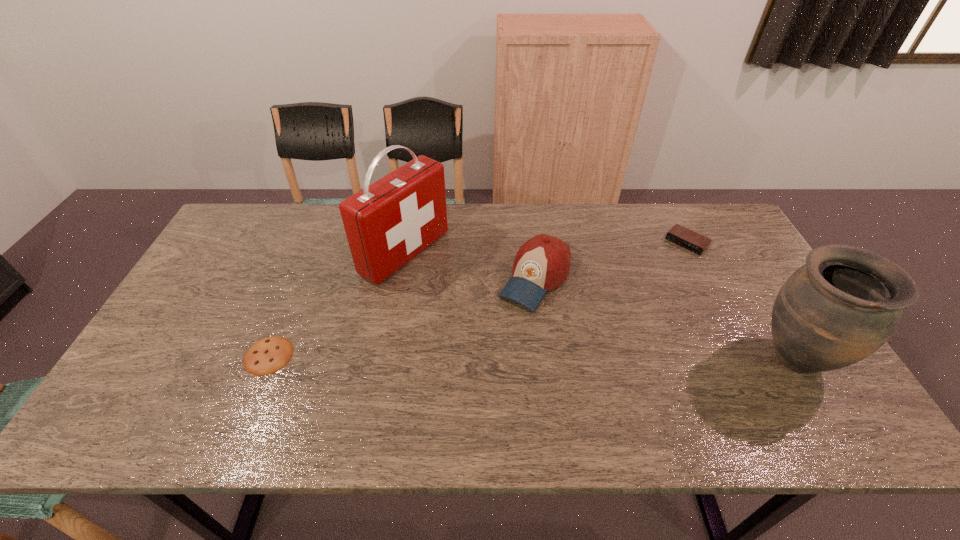
The image size is (960, 540). I want to click on the first-aid kit that is at the far edge, so click(387, 223).

Where is `alarm clock that is at the far edge`? alarm clock that is at the far edge is located at coordinates (684, 237).

Find the location of `cookie located at the near edge`. cookie located at the near edge is located at coordinates (266, 356).

Identify the location of urn present at the near edge. The width and height of the screenshot is (960, 540). (840, 307).

I want to click on urn at the right edge, so click(840, 307).

Find the location of `alarm clock that is at the right edge`. alarm clock that is at the right edge is located at coordinates (684, 237).

At what (x,y) coordinates should I click in order to perform the action: click on object that is at the far right corner. Please return your answer as a coordinate pair (x, y). Looking at the image, I should click on (684, 237).

At what (x,y) coordinates should I click in order to perform the action: click on object at the near right corner. Please return your answer as a coordinate pair (x, y). This screenshot has width=960, height=540. Looking at the image, I should click on (840, 307).

The width and height of the screenshot is (960, 540). In order to click on vacant space at the far edge of the desktop in this screenshot , I will do `click(636, 225)`.

At what (x,y) coordinates should I click in order to perform the action: click on free space at the near edge of the desktop. Please return your answer as a coordinate pair (x, y). The height and width of the screenshot is (540, 960). Looking at the image, I should click on (579, 391).